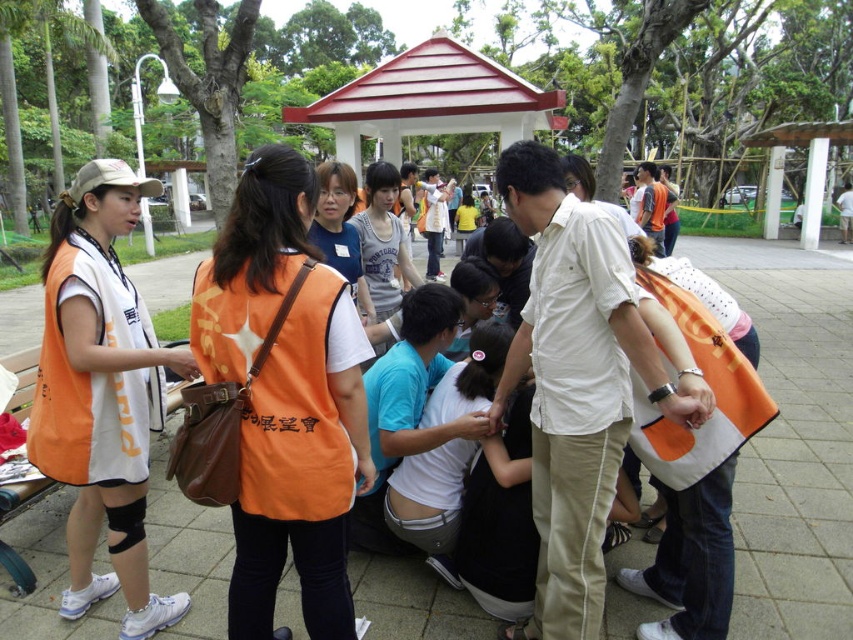
Question: Which of the following is the farthest from the observer?

Choices:
 (A) orange fabric vest at center
 (B) white matte gazebo at center

Answer: (B)

Question: Which object appears closest to the camera in this image?

Choices:
 (A) white matte gazebo at center
 (B) orange fabric vest at left
 (C) orange fabric vest at center

Answer: (C)

Question: Which object is the closest to the white matte gazebo at center?

Choices:
 (A) orange fabric vest at center
 (B) orange fabric vest at left

Answer: (B)

Question: Is orange fabric vest at left to the right of white matte gazebo at center from the viewer's perspective?

Choices:
 (A) yes
 (B) no

Answer: (B)

Question: Can you confirm if orange fabric vest at center is positioned to the right of orange fabric vest at left?

Choices:
 (A) yes
 (B) no

Answer: (A)

Question: Does orange fabric vest at center have a smaller size compared to orange fabric vest at left?

Choices:
 (A) yes
 (B) no

Answer: (A)